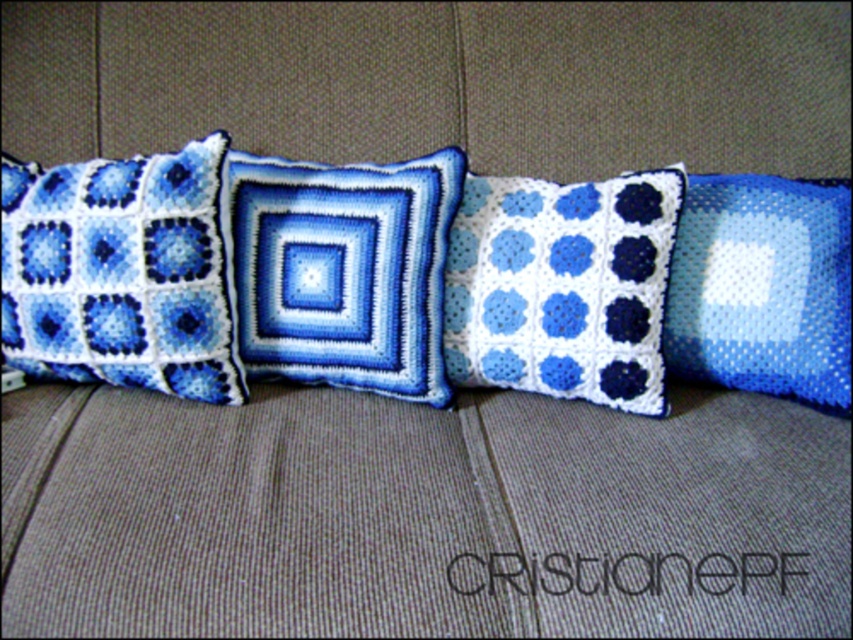
Between point (213, 369) and point (440, 172), which one is positioned behind?

Positioned behind is point (440, 172).

Is point (108, 269) closer to viewer compared to point (310, 323)?

Yes, point (108, 269) is in front of point (310, 323).

The height and width of the screenshot is (640, 853). Find the location of `crochet fabric pillow at left`. crochet fabric pillow at left is located at coordinates (120, 273).

Can you confirm if crochet fabric pillow at left is positioned to the right of white crochet pillow at center?

Incorrect, crochet fabric pillow at left is not on the right side of white crochet pillow at center.

Where is `crochet fabric pillow at left`? The width and height of the screenshot is (853, 640). crochet fabric pillow at left is located at coordinates (120, 273).

The height and width of the screenshot is (640, 853). I want to click on crochet fabric pillow at left, so click(120, 273).

Is crochet fabric pillow at left wider than blue mesh pillow at right?

Indeed, crochet fabric pillow at left has a greater width compared to blue mesh pillow at right.

Is crochet fabric pillow at left closer to the viewer compared to blue mesh pillow at right?

Yes, crochet fabric pillow at left is closer to the viewer.

Which is behind, point (80, 285) or point (817, 205)?

The point (817, 205) is behind.

The width and height of the screenshot is (853, 640). Identify the location of crochet fabric pillow at left. (120, 273).